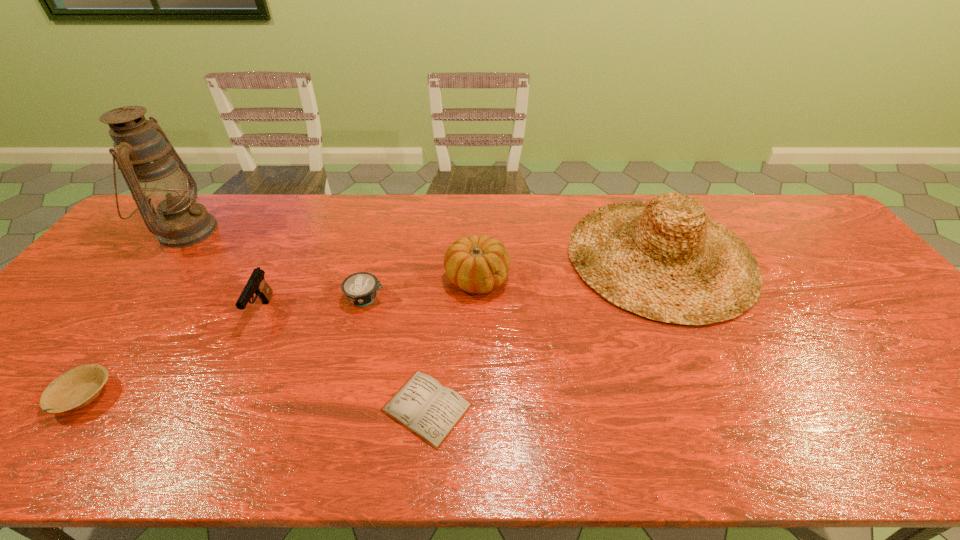
I want to click on the tallest object, so click(x=156, y=176).

Identify the location of sunhat. (666, 260).

At what (x,y) coordinates should I click in order to perform the action: click on the rightmost object. Please return your answer as a coordinate pair (x, y). This screenshot has height=540, width=960. Looking at the image, I should click on (666, 260).

The image size is (960, 540). Identify the location of gourd. (475, 264).

Where is `pistol`? This screenshot has width=960, height=540. pistol is located at coordinates (256, 284).

Locate an element on the screen. the fourth object from right to left is located at coordinates (360, 288).

Identify the location of yogurt. This screenshot has width=960, height=540. (360, 288).

Image resolution: width=960 pixels, height=540 pixels. In order to click on the sixth tallest object in this screenshot , I will do `click(78, 387)`.

Find the location of `diary`. diary is located at coordinates (424, 406).

You are a GUI agent. You are given a task and a screenshot of the screen. Output one action in this format:
    pyautogui.click(x=<x>, y=<y>)
    Task: Click on the vacant space positioned on the back of the tallest object
    The width and height of the screenshot is (960, 540).
    Given the screenshot: What is the action you would take?
    pyautogui.click(x=212, y=195)